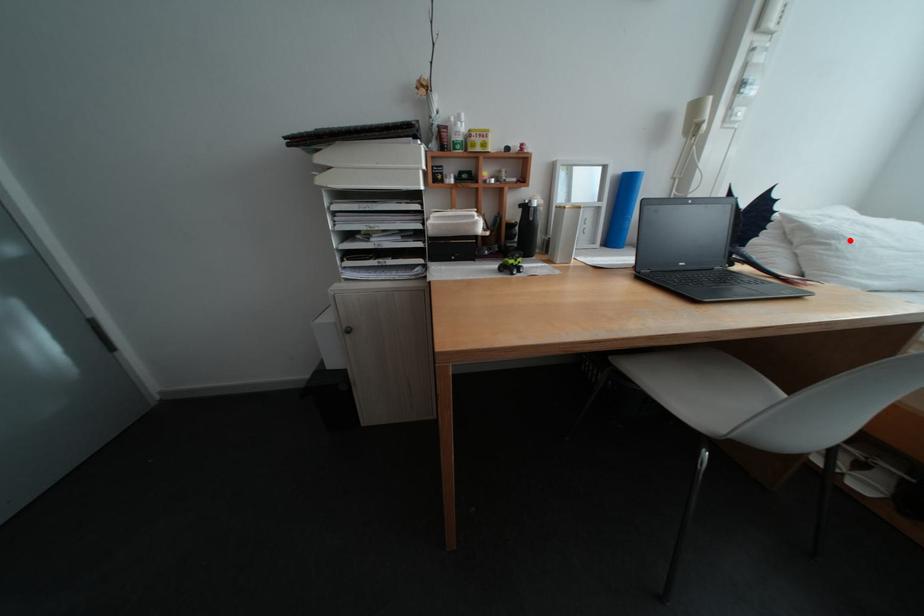
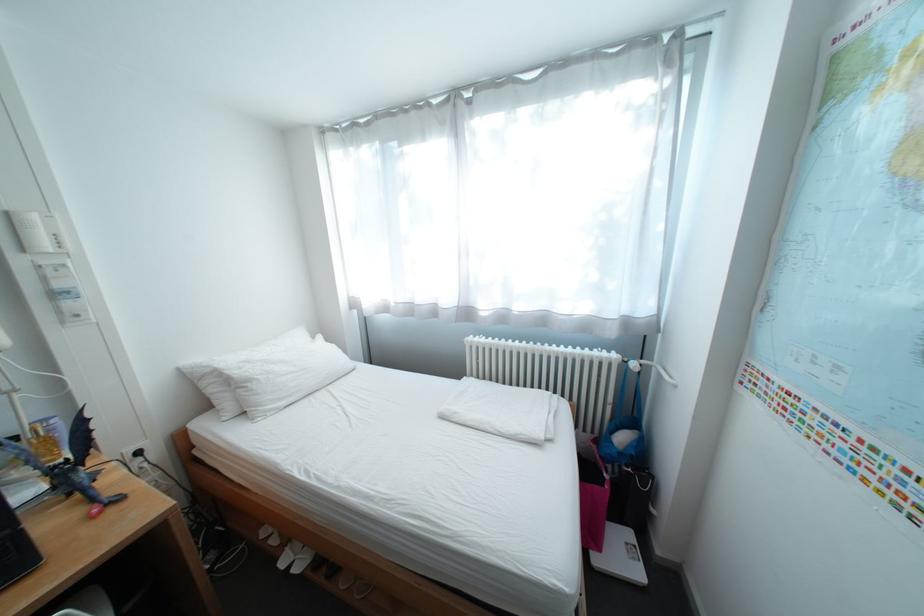
Find the pixel in the second image that matches the highlighted location in the first image.

(263, 383)